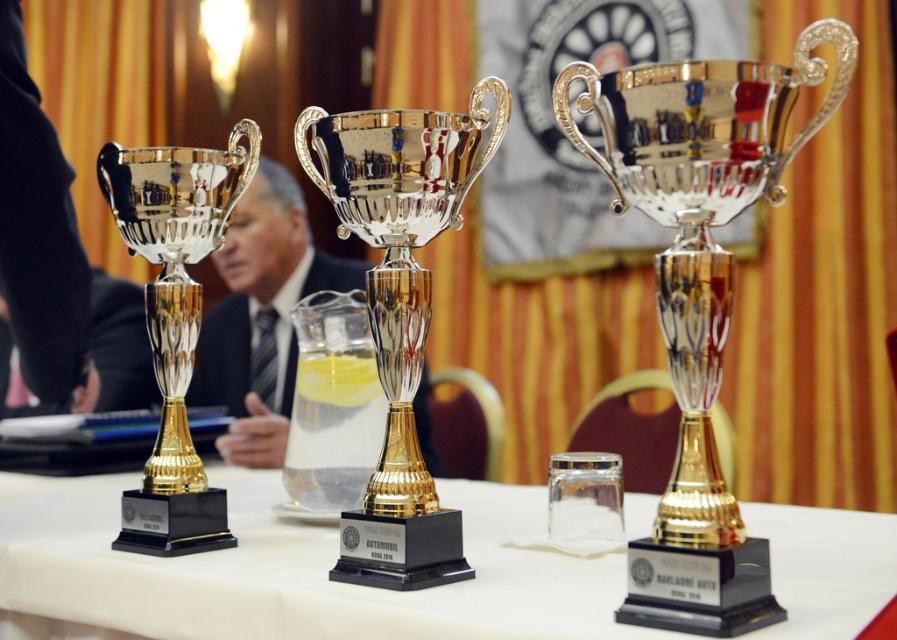
Question: Which object is closer to the camera taking this photo?

Choices:
 (A) polished metal trophy at center
 (B) polished silver trophy at center

Answer: (B)

Question: Is gold polished trophy at center smaller than matte black suit at center?

Choices:
 (A) yes
 (B) no

Answer: (A)

Question: Is metallic trophies at center to the right of matte black suit at center from the viewer's perspective?

Choices:
 (A) no
 (B) yes

Answer: (B)

Question: Which point is closer to the camera?

Choices:
 (A) polished metal trophy at center
 (B) polished silver trophy at center
 (C) matte black suit at center

Answer: (B)

Question: Which point is closer to the camera?

Choices:
 (A) polished silver trophy at left
 (B) gold polished trophy at center
 (C) metallic trophies at center
 (D) polished metal trophy at center

Answer: (C)

Question: Can you confirm if polished silver trophy at center is bigger than matte black suit at center?

Choices:
 (A) yes
 (B) no

Answer: (B)